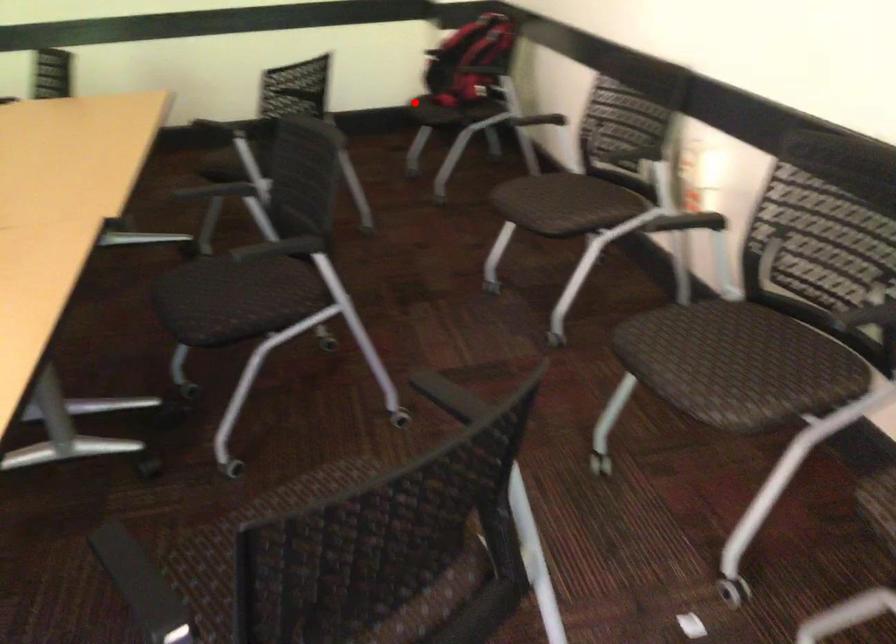
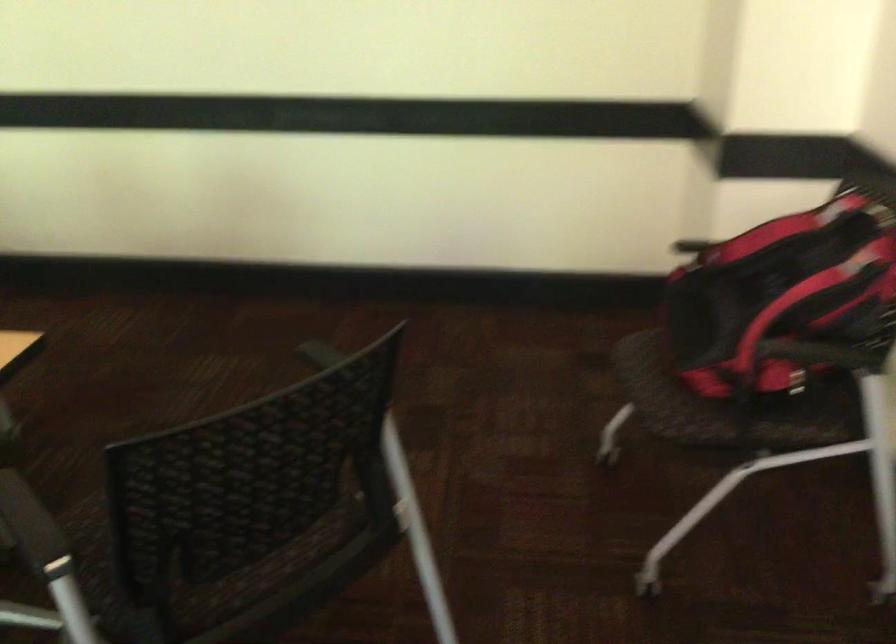
Question: I am providing you with two images of the same scene from different viewpoints. In image1, a red point is highlighted. Considering the same 3D point in image2, which of the following is correct?

Choices:
 (A) It is closer
 (B) It is farther

Answer: (A)